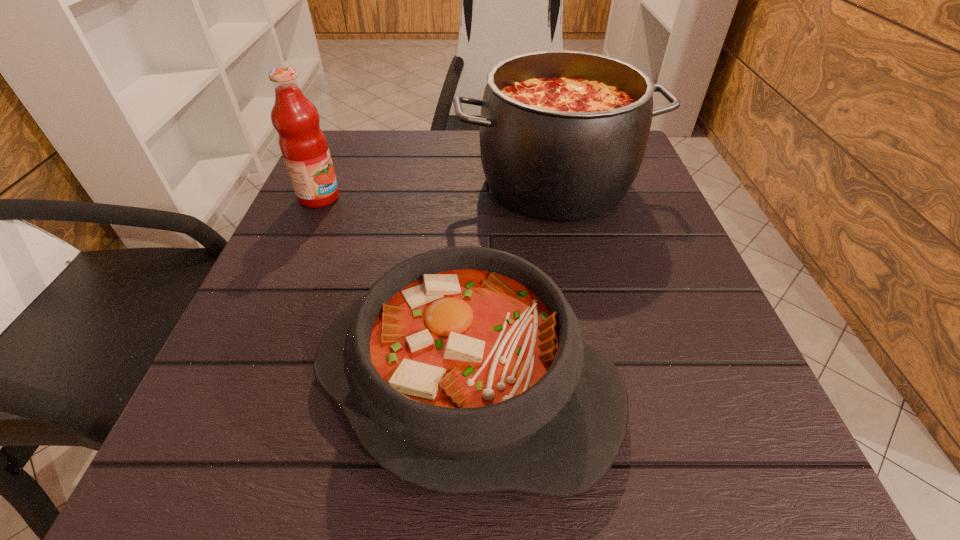
Identify the location of free space that satisfies the following two spatial constraints: 1. on the front label of the nearest object; 2. on the left side of the fruit juice. (237, 383).

Identify the location of vacant area that satisfies the following two spatial constraints: 1. on the front label of the leftmost object; 2. on the back side of the shortest object. Image resolution: width=960 pixels, height=540 pixels. (237, 383).